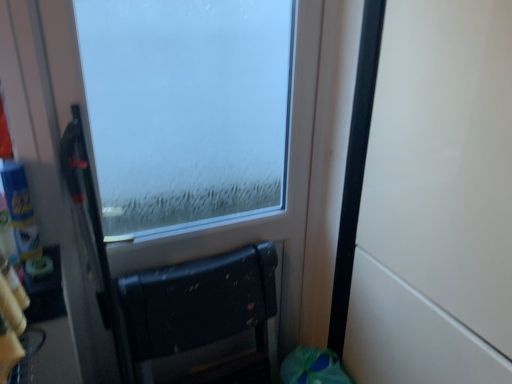
Image resolution: width=512 pixels, height=384 pixels. I want to click on frosted glass window at center, so click(x=187, y=108).

Identify the location of white matte door at right. (437, 201).

Does black matte chair at lower center have a smaller size compared to white matte door at right?

Yes, black matte chair at lower center is smaller than white matte door at right.

Is black matte chair at lower center beside white matte door at right?

No, black matte chair at lower center is not touching white matte door at right.

Image resolution: width=512 pixels, height=384 pixels. In order to click on furniture below the white matte door at right (from the image's perspective) in this screenshot , I will do `click(202, 318)`.

How different are the orientations of black matte chair at lower center and white matte door at right in degrees?

They differ by 93.1 degrees in their facing directions.

Could you tell me if frosted glass window at center is turned towards black matte chair at lower center?

Yes, frosted glass window at center is oriented towards black matte chair at lower center.

Which object is wider, frosted glass window at center or black matte chair at lower center?

black matte chair at lower center is wider.

Looking at this image, considering the relative sizes of frosted glass window at center and black matte chair at lower center in the image provided, is frosted glass window at center bigger than black matte chair at lower center?

Yes, frosted glass window at center is bigger than black matte chair at lower center.

Is frosted glass window at center at the left side of white matte door at right?

Correct, you'll find frosted glass window at center to the left of white matte door at right.

Which point is more forward, [232,112] or [472,382]?

The point [472,382] is more forward.

From a real-world perspective, which object rests below the other?

white matte door at right.

Does frosted glass window at center have a larger size compared to white matte door at right?

No, frosted glass window at center is not bigger than white matte door at right.

Is white matte door at right inside the boundaries of frosted glass window at center, or outside?

white matte door at right is not enclosed by frosted glass window at center.

Is white matte door at right facing towards frosted glass window at center?

No.

At what (x,y) coordinates should I click in order to perform the action: click on door on the right side of frosted glass window at center. Please return your answer as a coordinate pair (x, y). Looking at the image, I should click on (437, 201).

From the image's perspective, who appears lower, black matte chair at lower center or frosted glass window at center?

black matte chair at lower center appears lower in the image.

Considering the positions of objects black matte chair at lower center and frosted glass window at center in the image provided, who is in front, black matte chair at lower center or frosted glass window at center?

frosted glass window at center is more forward.

Is black matte chair at lower center to the left or to the right of frosted glass window at center in the image?

In the image, black matte chair at lower center appears on the left side of frosted glass window at center.

How different are the orientations of black matte chair at lower center and frosted glass window at center in degrees?

They differ by 1.04 degrees in their facing directions.

How much distance is there between white matte door at right and black matte chair at lower center?

white matte door at right is 23.08 inches from black matte chair at lower center.

Considering the positions of point (373, 277) and point (162, 340), is point (373, 277) closer or farther from the camera than point (162, 340)?

Point (373, 277) appears to be farther away from the viewer than point (162, 340).

Which object is closer to the camera, white matte door at right or black matte chair at lower center?

Positioned in front is white matte door at right.

From the image's perspective, is white matte door at right above black matte chair at lower center?

Yes, from the image's perspective, white matte door at right is over black matte chair at lower center.

This screenshot has width=512, height=384. In order to click on furniture located underneath the white matte door at right (from a real-world perspective) in this screenshot , I will do `click(202, 318)`.

The image size is (512, 384). What are the coordinates of `window in front of the black matte chair at lower center` in the screenshot? It's located at (187, 108).

Which object lies nearer to the anchor point frosted glass window at center, black matte chair at lower center or white matte door at right?

black matte chair at lower center lies closer to frosted glass window at center than the other object.

When comparing their distances from white matte door at right, does frosted glass window at center or black matte chair at lower center seem closer?

black matte chair at lower center is closer to white matte door at right.

Which object lies further to the anchor point frosted glass window at center, white matte door at right or black matte chair at lower center?

white matte door at right.

Based on their spatial positions, is frosted glass window at center or white matte door at right further from black matte chair at lower center?

frosted glass window at center is positioned further to the anchor black matte chair at lower center.

From the image, which object appears to be farther from black matte chair at lower center, white matte door at right or frosted glass window at center?

Based on the image, frosted glass window at center appears to be further to black matte chair at lower center.

Considering their positions, is black matte chair at lower center positioned further to white matte door at right than frosted glass window at center?

frosted glass window at center.

At what (x,y) coordinates should I click in order to perform the action: click on window between black matte chair at lower center and white matte door at right in the horizontal direction. Please return your answer as a coordinate pair (x, y). This screenshot has height=384, width=512. Looking at the image, I should click on (187, 108).